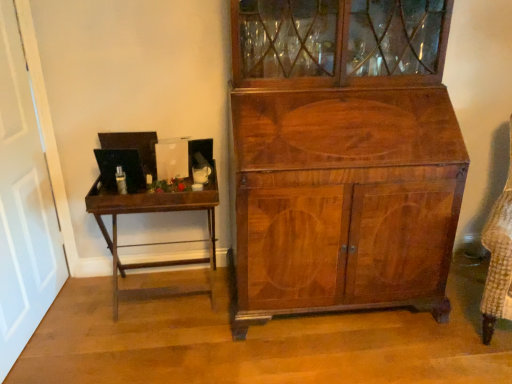
Identify the location of vacant space underneath wooden table at left (from a real-world perspective). This screenshot has width=512, height=384. (166, 298).